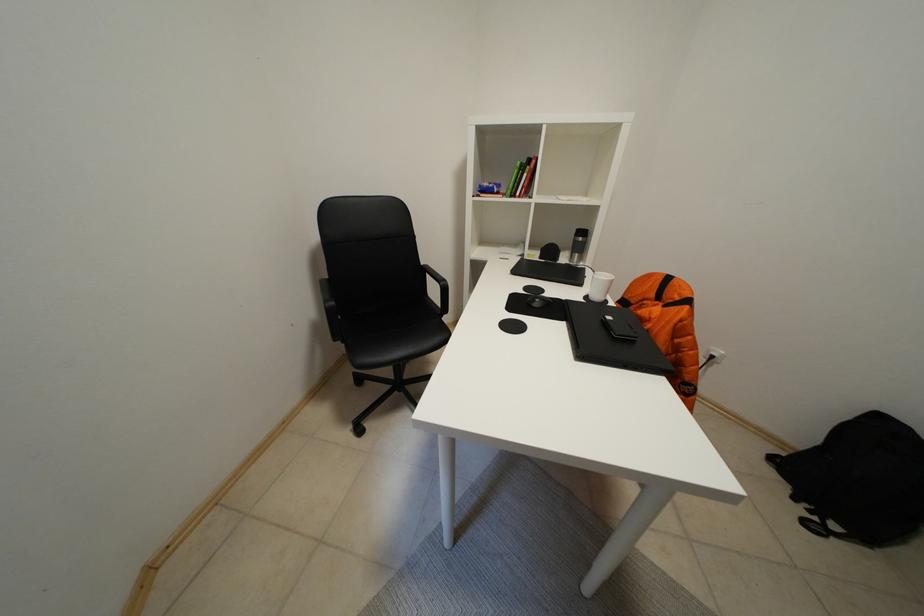
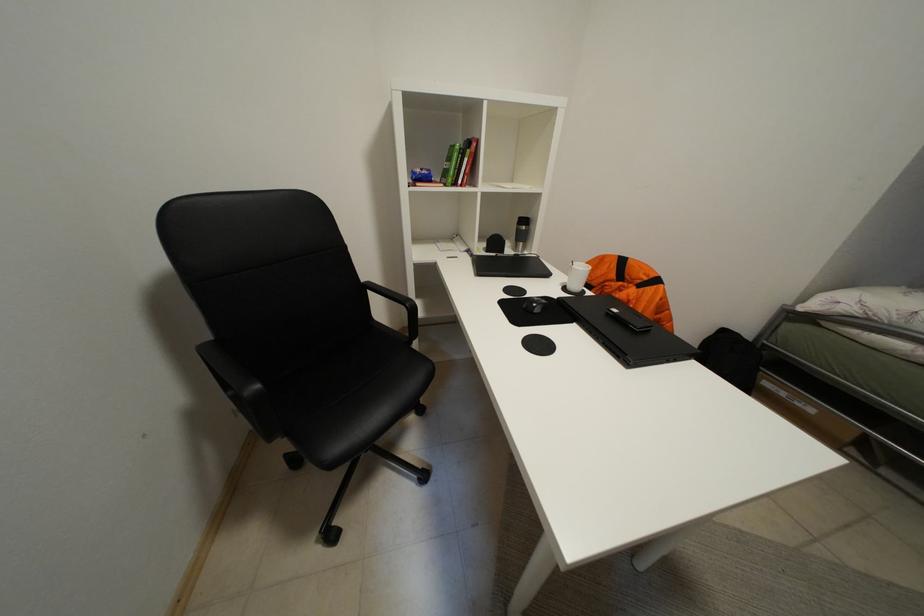
What movement of the cameraman would produce the second image?

The cameraman walked toward left, forward.